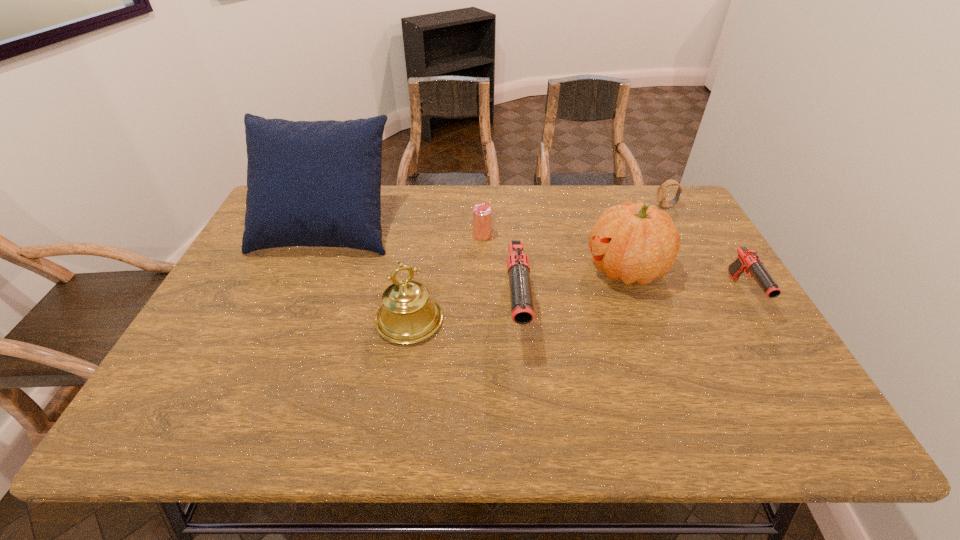
Identify the location of the sixth object from right to left. tap(408, 315).

Locate an element on the screen. vacant space located 0.090m at the aiming end of the left gun is located at coordinates (522, 392).

Identify the location of vacant area situated 0.060m at the aiming end of the rightmost object. Image resolution: width=960 pixels, height=540 pixels. (771, 338).

Locate an element on the screen. The width and height of the screenshot is (960, 540). vacant space situated on the facing side of the leftmost object is located at coordinates (292, 309).

Where is `free space located 0.160m on the face of the sixth object from left to right`? The width and height of the screenshot is (960, 540). free space located 0.160m on the face of the sixth object from left to right is located at coordinates (608, 206).

I want to click on vacant space situated on the face of the sixth object from left to right, so 535,206.

Locate an element on the screen. The image size is (960, 540). vacant space positioned on the face of the sixth object from left to right is located at coordinates (638, 206).

You are a GUI agent. You are given a task and a screenshot of the screen. Output one action in this format:
    pyautogui.click(x=<x>, y=<y>)
    Task: Click on the vacant region located 0.330m on the carved face of the sixth shortest object
    The height and width of the screenshot is (540, 960).
    Given the screenshot: What is the action you would take?
    pyautogui.click(x=467, y=269)

The height and width of the screenshot is (540, 960). I want to click on vacant space situated on the carved face of the sixth shortest object, so click(x=528, y=269).

Locate an element on the screen. The width and height of the screenshot is (960, 540). vacant space situated 0.060m on the carved face of the sixth shortest object is located at coordinates (564, 269).